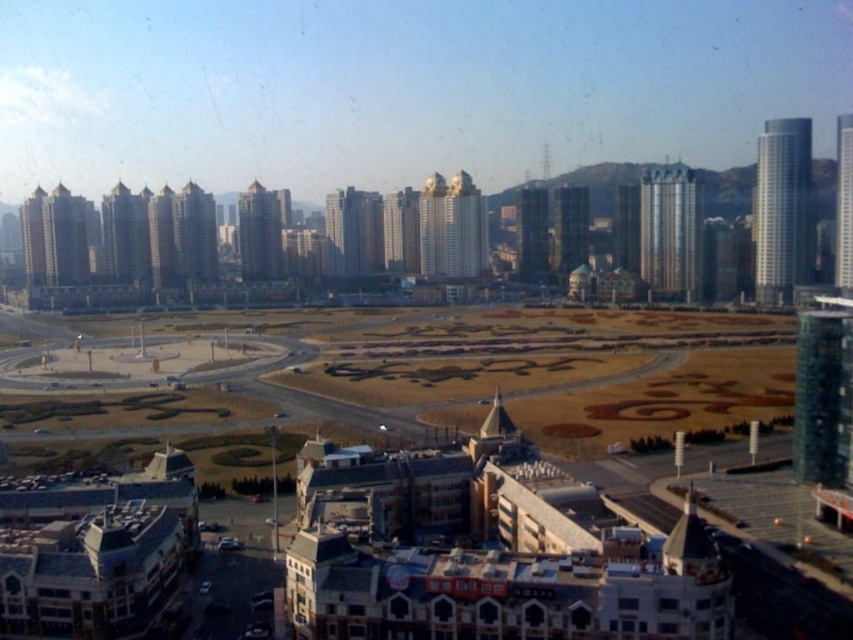
Does gold reflective building at center appear over glassy silver skyscraper at center?

Yes, gold reflective building at center is above glassy silver skyscraper at center.

Can you confirm if gold reflective building at center is smaller than glassy silver skyscraper at center?

Actually, gold reflective building at center might be larger than glassy silver skyscraper at center.

What do you see at coordinates (451, 227) in the screenshot?
I see `gold reflective building at center` at bounding box center [451, 227].

Find the location of a particular element. gold reflective building at center is located at coordinates (451, 227).

Can you confirm if shiny glass skyscraper at right is shorter than silver metallic skyscraper at upper right?

In fact, shiny glass skyscraper at right may be taller than silver metallic skyscraper at upper right.

Consider the image. Can you confirm if shiny glass skyscraper at right is positioned to the left of silver metallic skyscraper at upper right?

Incorrect, shiny glass skyscraper at right is not on the left side of silver metallic skyscraper at upper right.

This screenshot has width=853, height=640. What do you see at coordinates (782, 209) in the screenshot? I see `shiny glass skyscraper at right` at bounding box center [782, 209].

Find the location of a particular element. shiny glass skyscraper at right is located at coordinates pos(782,209).

Does shiny glass skyscraper at right have a greater width compared to gold reflective building at center?

No, shiny glass skyscraper at right is not wider than gold reflective building at center.

Where is `shiny glass skyscraper at right`? shiny glass skyscraper at right is located at coordinates (782, 209).

Find the location of a particular element. The width and height of the screenshot is (853, 640). shiny glass skyscraper at right is located at coordinates (782, 209).